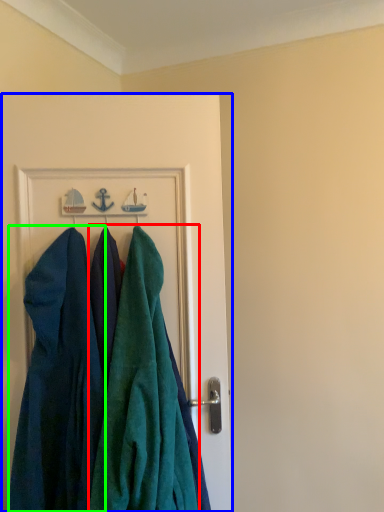
Question: Which is nearer to the towel (highlighted by a red box)? door (highlighted by a blue box) or dress (highlighted by a green box).

Choices:
 (A) door
 (B) dress

Answer: (B)